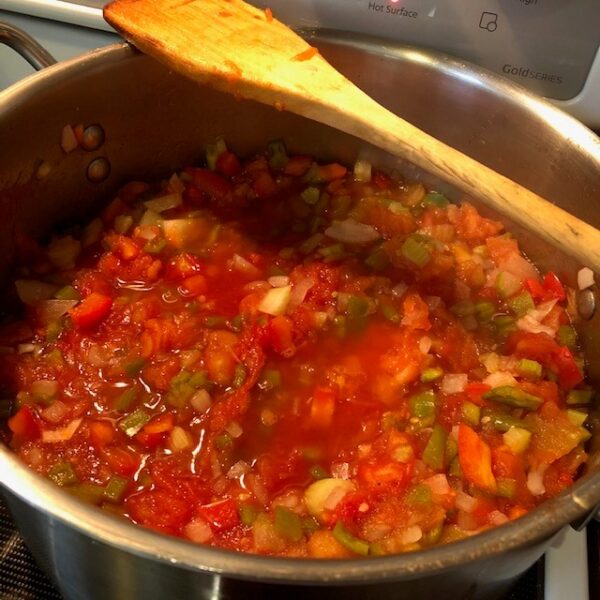
Identify the location of pot handle. (22, 37).